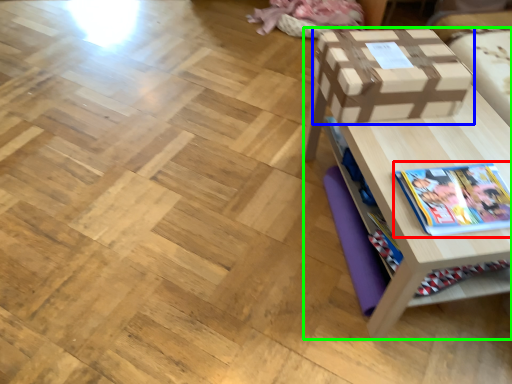
Question: Which object is positioned farthest from book (highlighted by a red box)? Select from box (highlighted by a blue box) and table (highlighted by a green box).

Choices:
 (A) box
 (B) table

Answer: (A)